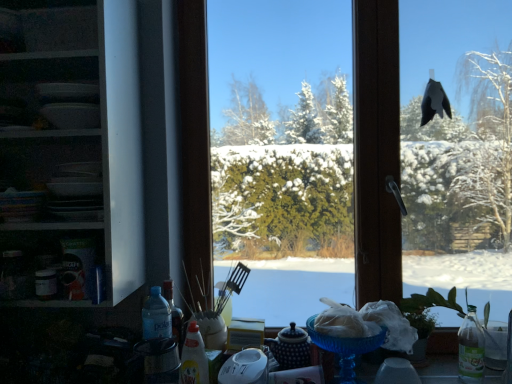
Question: Is blue glass bowl at lower center wider or thinner than white glossy shelves at left?

Choices:
 (A) thin
 (B) wide

Answer: (A)

Question: In terms of size, does blue glass bowl at lower center appear bigger or smaller than white glossy shelves at left?

Choices:
 (A) big
 (B) small

Answer: (B)

Question: Which of these objects is positioned farthest from the transparent glass window at center?

Choices:
 (A) blue glass bowl at lower center
 (B) white glossy shelves at left
 (C) translucent plastic bottle at center

Answer: (C)

Question: Which of these objects is positioned farthest from the translucent plastic bottle at center?

Choices:
 (A) blue glass bowl at lower center
 (B) transparent glass window at center
 (C) white glossy shelves at left

Answer: (B)